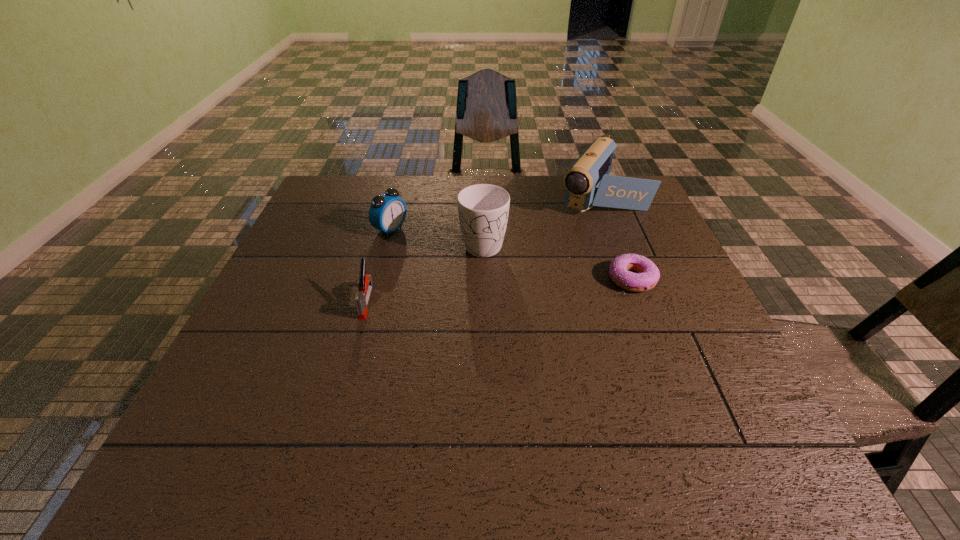
You are a GUI agent. You are given a task and a screenshot of the screen. Output one action in this format:
    pyautogui.click(x=<x>, y=<y>)
    Task: Click on the blank space located on the face of the third tallest object
    The height and width of the screenshot is (540, 960).
    Given the screenshot: What is the action you would take?
    pyautogui.click(x=496, y=279)

The width and height of the screenshot is (960, 540). Find the location of `vacant space situated 0.360m on the face of the third tallest object`. vacant space situated 0.360m on the face of the third tallest object is located at coordinates (510, 286).

Where is `vacant area situated on the face of the third tallest object`? vacant area situated on the face of the third tallest object is located at coordinates (427, 247).

The image size is (960, 540). What are the coordinates of `free space located 0.270m on the side of the camcorder with the flip-out screen` in the screenshot? It's located at (549, 272).

The width and height of the screenshot is (960, 540). I want to click on vacant area situated on the side of the camcorder with the flip-out screen, so click(529, 300).

The height and width of the screenshot is (540, 960). In order to click on vacant space located on the side of the camcorder with the flip-out screen in this screenshot , I will do `click(553, 265)`.

Locate an element on the screen. This screenshot has width=960, height=540. object that is positioned at the far edge is located at coordinates (588, 179).

The width and height of the screenshot is (960, 540). Identify the location of doughnut present at the right edge. (648, 274).

Where is `camcorder that is at the right edge`? Image resolution: width=960 pixels, height=540 pixels. camcorder that is at the right edge is located at coordinates (588, 179).

Image resolution: width=960 pixels, height=540 pixels. What are the coordinates of `object situated at the far right corner` in the screenshot? It's located at (588, 179).